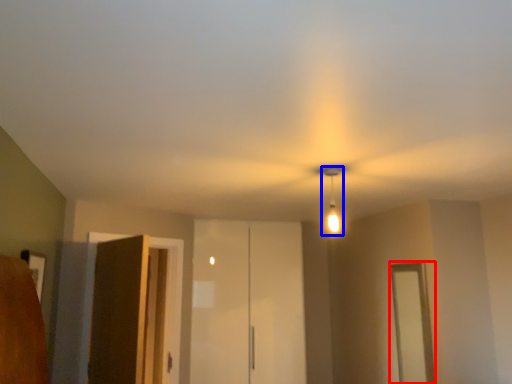
Question: Which object appears farthest to the camera in this image, window (highlighted by a red box) or light fixture (highlighted by a blue box)?

Choices:
 (A) window
 (B) light fixture

Answer: (A)